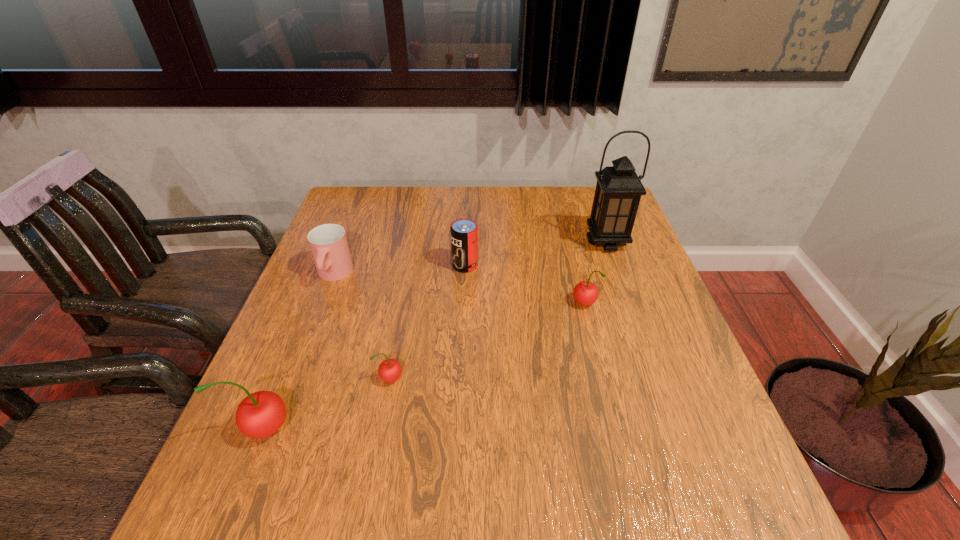
This screenshot has width=960, height=540. In order to click on object situated at the near left corner in this screenshot , I will do (261, 414).

Where is `vacant area at the far edge`? The image size is (960, 540). vacant area at the far edge is located at coordinates (524, 209).

This screenshot has width=960, height=540. In order to click on vacant space at the near edge of the desktop in this screenshot , I will do `click(444, 428)`.

Identify the location of free space at the left edge of the desktop. (312, 408).

I want to click on free space at the right edge, so click(x=637, y=244).

The height and width of the screenshot is (540, 960). In the image, there is a desktop. In order to click on vacant area at the far left corner in this screenshot , I will do `click(349, 194)`.

I want to click on free spot at the far right corner of the desktop, so click(x=579, y=189).

Identify the location of free space between the lantern and the fifth farthest object. (498, 310).

Identify the location of vacant point located between the second tallest cherry and the third object from left to right. Image resolution: width=960 pixels, height=540 pixels. (488, 342).

Identify the location of free space between the tallest cherry and the farthest object. (436, 335).